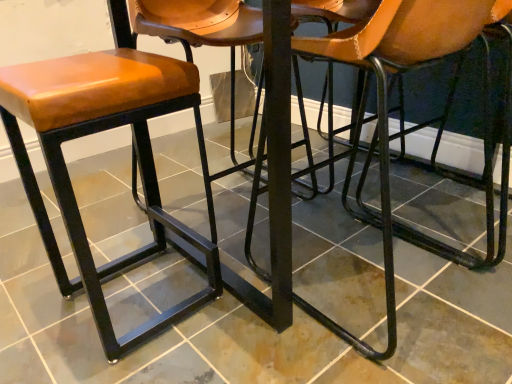
Image resolution: width=512 pixels, height=384 pixels. In order to click on free spot behind matte brown leather stool at left in this screenshot , I will do `click(158, 242)`.